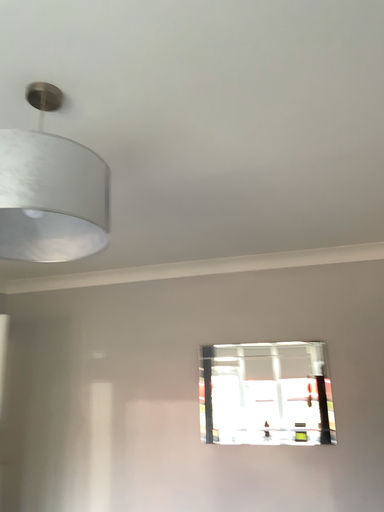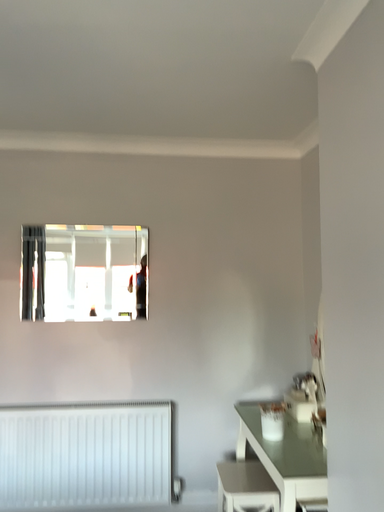
Question: How did the camera likely rotate when shooting the video?

Choices:
 (A) rotated downward
 (B) rotated upward

Answer: (A)